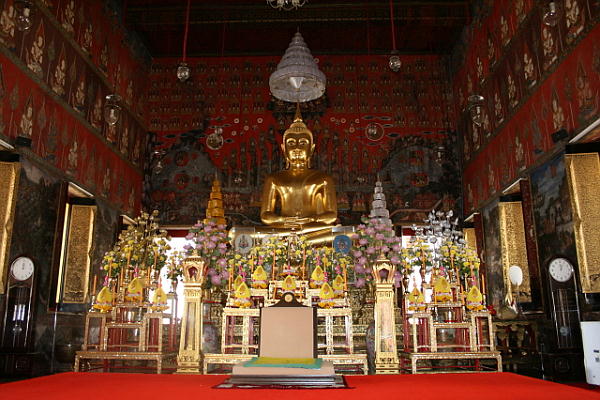
The image size is (600, 400). Identify the location of only hanging decoration. (179, 76), (397, 59), (304, 81), (287, 9).